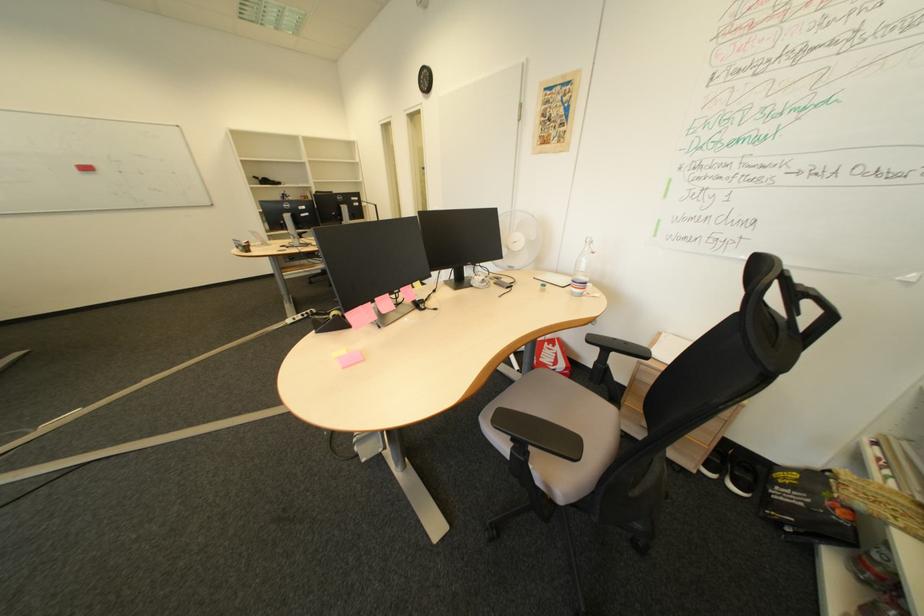
Where would you lift the white coffee cup? Please return your answer as a coordinate pair (x, y).

(578, 284)